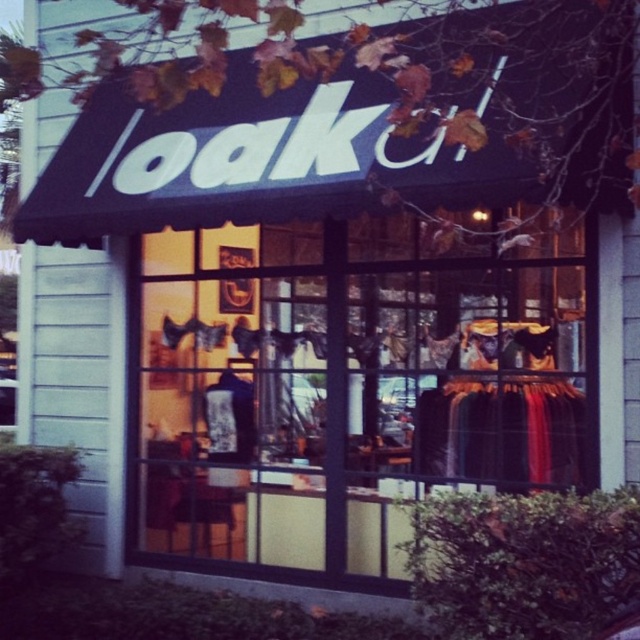
Question: Can you confirm if transparent glass shop window at center is positioned to the left of black fabric dress at center?

Choices:
 (A) yes
 (B) no

Answer: (A)

Question: Is transparent glass shop window at center to the left of black fabric dress at center from the viewer's perspective?

Choices:
 (A) no
 (B) yes

Answer: (B)

Question: Does transparent glass shop window at center appear on the right side of black fabric dress at center?

Choices:
 (A) yes
 (B) no

Answer: (B)

Question: Which of the following is the closest to the observer?

Choices:
 (A) (451, 397)
 (B) (225, 452)

Answer: (A)

Question: Among these points, which one is farthest from the camera?

Choices:
 (A) (480, 435)
 (B) (294, 440)

Answer: (B)

Question: Which point is farther from the camera taking this photo?

Choices:
 (A) (324, 372)
 (B) (442, 397)

Answer: (A)